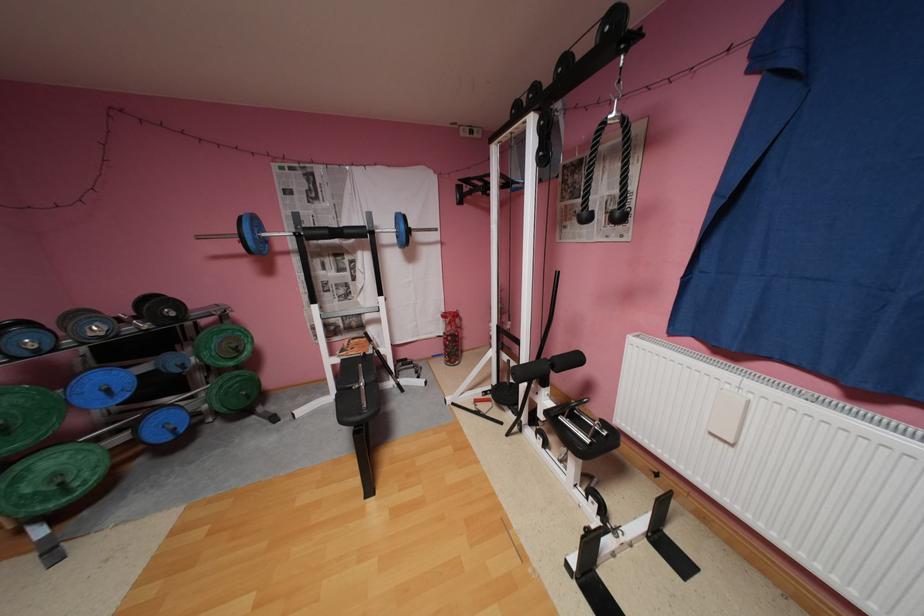
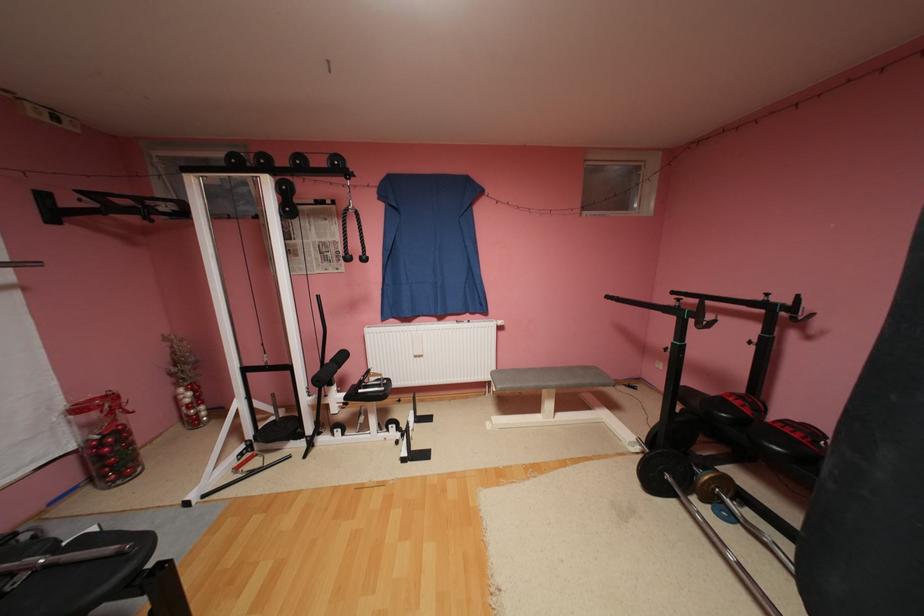
Question: The camera is either moving clockwise (left) or counter-clockwise (right) around the object. The first image is from the beginning of the video and the second image is from the end. Is the camera moving left or right when shooting the video?

Choices:
 (A) Left
 (B) Right

Answer: (A)